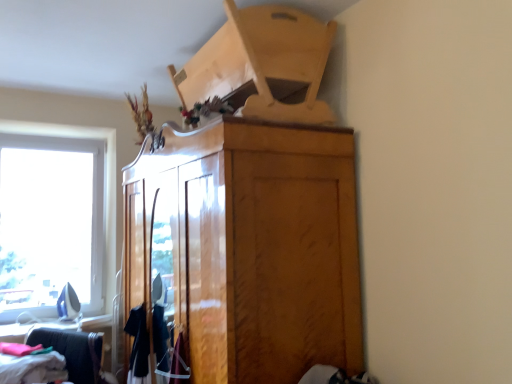
The height and width of the screenshot is (384, 512). What do you see at coordinates (73, 351) in the screenshot? I see `matte black clothing at lower left` at bounding box center [73, 351].

Measure the distance between matte black clothing at lower left and camera.

8.33 feet.

The height and width of the screenshot is (384, 512). What do you see at coordinates (138, 344) in the screenshot?
I see `black fabric shirt at lower left, positioned as the 2th clothing in right-to-left order` at bounding box center [138, 344].

The height and width of the screenshot is (384, 512). I want to click on velvet burgundy dress at lower center, arranged as the third clothing when viewed from the left, so click(x=180, y=363).

The width and height of the screenshot is (512, 384). Describe the element at coordinates (32, 368) in the screenshot. I see `soft cotton clothes at lower left, which appears as the 3th clothing when viewed from the right` at that location.

You are a GUI agent. You are given a task and a screenshot of the screen. Output one action in this format:
    pyautogui.click(x=<x>, y=<y>)
    Task: Click on the matte black clothing at lower left
    
    Given the screenshot: What is the action you would take?
    pyautogui.click(x=73, y=351)

From a real-world perspective, does black fabric shirt at lower left, positioned as the 2th clothing in right-to-left order, stand above glossy wood cabinet at center?

No, from a real-world perspective, black fabric shirt at lower left, positioned as the 2th clothing in right-to-left order, is not on top of glossy wood cabinet at center.

How many degrees apart are the facing directions of black fabric shirt at lower left, the second clothing in the left-to-right sequence, and glossy wood cabinet at center?

There is a 1.53-degree angle between the facing directions of black fabric shirt at lower left, the second clothing in the left-to-right sequence, and glossy wood cabinet at center.

Which of these two, black fabric shirt at lower left, the second clothing in the left-to-right sequence, or glossy wood cabinet at center, is smaller?

black fabric shirt at lower left, the second clothing in the left-to-right sequence, is smaller.

What's the angular difference between matte black clothing at lower left and black fabric shirt at lower left, the second clothing in the left-to-right sequence,'s facing directions?

There is a 37.9-degree angle between the facing directions of matte black clothing at lower left and black fabric shirt at lower left, the second clothing in the left-to-right sequence.

Are matte black clothing at lower left and black fabric shirt at lower left, the second clothing in the left-to-right sequence, far apart?

Actually, matte black clothing at lower left and black fabric shirt at lower left, the second clothing in the left-to-right sequence, are a little close together.

Between matte black clothing at lower left and black fabric shirt at lower left, the second clothing in the left-to-right sequence, which one is positioned behind?

black fabric shirt at lower left, the second clothing in the left-to-right sequence.

In the scene shown: Is matte black clothing at lower left oriented towards black fabric shirt at lower left, the second clothing in the left-to-right sequence?

No.

How many degrees apart are the facing directions of soft cotton clothes at lower left, which appears as the 3th clothing when viewed from the right, and velvet burgundy dress at lower center, acting as the first clothing starting from the right?

soft cotton clothes at lower left, which appears as the 3th clothing when viewed from the right, and velvet burgundy dress at lower center, acting as the first clothing starting from the right, are facing 46.9 degrees away from each other.

Is velvet burgundy dress at lower center, arranged as the third clothing when viewed from the left, at the back of soft cotton clothes at lower left, which appears as the 3th clothing when viewed from the right?

No, velvet burgundy dress at lower center, arranged as the third clothing when viewed from the left, is not at the back of soft cotton clothes at lower left, which appears as the 3th clothing when viewed from the right.

Is soft cotton clothes at lower left, which is counted as the 1th clothing, starting from the left, wider or thinner than velvet burgundy dress at lower center, arranged as the third clothing when viewed from the left?

soft cotton clothes at lower left, which is counted as the 1th clothing, starting from the left, is wider than velvet burgundy dress at lower center, arranged as the third clothing when viewed from the left.

Based on the photo, what's the angular difference between matte black clothing at lower left and soft cotton clothes at lower left, which appears as the 3th clothing when viewed from the right,'s facing directions?

matte black clothing at lower left and soft cotton clothes at lower left, which appears as the 3th clothing when viewed from the right, are facing 8.97 degrees away from each other.

Relative to soft cotton clothes at lower left, which is counted as the 1th clothing, starting from the left, is matte black clothing at lower left in front or behind?

matte black clothing at lower left is in front of soft cotton clothes at lower left, which is counted as the 1th clothing, starting from the left.

Based on the photo, is matte black clothing at lower left in contact with soft cotton clothes at lower left, which is counted as the 1th clothing, starting from the left?

No, matte black clothing at lower left is not beside soft cotton clothes at lower left, which is counted as the 1th clothing, starting from the left.

From the image's perspective, is matte black clothing at lower left located above soft cotton clothes at lower left, which appears as the 3th clothing when viewed from the right?

Actually, matte black clothing at lower left appears below soft cotton clothes at lower left, which appears as the 3th clothing when viewed from the right, in the image.

Is point (180, 354) more distant than point (345, 139)?

Yes, point (180, 354) is behind point (345, 139).

Locate an element on the screen. the 1st clothing located beneath the glossy wood cabinet at center (from a real-world perspective) is located at coordinates (180, 363).

What's the angular difference between velvet burgundy dress at lower center, arranged as the third clothing when viewed from the left, and glossy wood cabinet at center's facing directions?

velvet burgundy dress at lower center, arranged as the third clothing when viewed from the left, and glossy wood cabinet at center are facing 1.53 degrees away from each other.

Which of these two, velvet burgundy dress at lower center, arranged as the third clothing when viewed from the left, or glossy wood cabinet at center, stands taller?

glossy wood cabinet at center is taller.

Can you confirm if matte black clothing at lower left is positioned to the left of glossy wood cabinet at center?

Indeed, matte black clothing at lower left is positioned on the left side of glossy wood cabinet at center.

Considering the points (79, 345) and (337, 276), which point is behind, point (79, 345) or point (337, 276)?

The point (79, 345) is farther.

Does matte black clothing at lower left have a larger size compared to glossy wood cabinet at center?

Actually, matte black clothing at lower left might be smaller than glossy wood cabinet at center.

Is matte black clothing at lower left aimed at glossy wood cabinet at center?

No, matte black clothing at lower left is not aimed at glossy wood cabinet at center.

Measure the distance between velvet burgundy dress at lower center, acting as the first clothing starting from the right, and matte black clothing at lower left.

The distance of velvet burgundy dress at lower center, acting as the first clothing starting from the right, from matte black clothing at lower left is 1.04 meters.

Can you confirm if velvet burgundy dress at lower center, acting as the first clothing starting from the right, is taller than matte black clothing at lower left?

No, velvet burgundy dress at lower center, acting as the first clothing starting from the right, is not taller than matte black clothing at lower left.

In the image, is velvet burgundy dress at lower center, acting as the first clothing starting from the right, positioned in front of or behind matte black clothing at lower left?

Clearly, velvet burgundy dress at lower center, acting as the first clothing starting from the right, is in front of matte black clothing at lower left.

Is velvet burgundy dress at lower center, acting as the first clothing starting from the right, beside matte black clothing at lower left?

No, velvet burgundy dress at lower center, acting as the first clothing starting from the right, is not in contact with matte black clothing at lower left.

Where is `cabinetry on the right of the black fabric shirt at lower left, positioned as the 2th clothing in right-to-left order`? cabinetry on the right of the black fabric shirt at lower left, positioned as the 2th clothing in right-to-left order is located at coordinates (251, 246).

From a real-world perspective, which clothing is the 2nd one above the matte black clothing at lower left? Please provide its 2D coordinates.

[(138, 344)]

From the picture: Estimate the real-world distances between objects in this image. Which object is closer to velvet burgundy dress at lower center, arranged as the third clothing when viewed from the left, matte black clothing at lower left or black fabric shirt at lower left, positioned as the 2th clothing in right-to-left order?

Based on the image, black fabric shirt at lower left, positioned as the 2th clothing in right-to-left order, appears to be nearer to velvet burgundy dress at lower center, arranged as the third clothing when viewed from the left.

In the scene shown: Based on their spatial positions, is black fabric shirt at lower left, positioned as the 2th clothing in right-to-left order, or velvet burgundy dress at lower center, acting as the first clothing starting from the right, closer to matte black clothing at lower left?

Based on the image, black fabric shirt at lower left, positioned as the 2th clothing in right-to-left order, appears to be nearer to matte black clothing at lower left.

From the image, which object appears to be farther from matte black clothing at lower left, black fabric shirt at lower left, positioned as the 2th clothing in right-to-left order, or glossy wood cabinet at center?

Among the two, glossy wood cabinet at center is located further to matte black clothing at lower left.

Looking at the image, which one is located further to velvet burgundy dress at lower center, acting as the first clothing starting from the right, black fabric shirt at lower left, the second clothing in the left-to-right sequence, or glossy wood cabinet at center?

Among the two, glossy wood cabinet at center is located further to velvet burgundy dress at lower center, acting as the first clothing starting from the right.

When comparing their distances from glossy wood cabinet at center, does matte black clothing at lower left or velvet burgundy dress at lower center, acting as the first clothing starting from the right, seem further?

The object further to glossy wood cabinet at center is matte black clothing at lower left.

Estimate the real-world distances between objects in this image. Which object is closer to velvet burgundy dress at lower center, acting as the first clothing starting from the right, glossy wood cabinet at center or matte black clothing at lower left?

Among the two, glossy wood cabinet at center is located nearer to velvet burgundy dress at lower center, acting as the first clothing starting from the right.

Considering their positions, is black fabric shirt at lower left, positioned as the 2th clothing in right-to-left order, positioned closer to glossy wood cabinet at center than soft cotton clothes at lower left, which is counted as the 1th clothing, starting from the left?

black fabric shirt at lower left, positioned as the 2th clothing in right-to-left order.

Which object lies further to the anchor point soft cotton clothes at lower left, which is counted as the 1th clothing, starting from the left, black fabric shirt at lower left, the second clothing in the left-to-right sequence, or velvet burgundy dress at lower center, acting as the first clothing starting from the right?

velvet burgundy dress at lower center, acting as the first clothing starting from the right, lies further to soft cotton clothes at lower left, which is counted as the 1th clothing, starting from the left, than the other object.

Find the location of a particular element. This screenshot has width=512, height=384. clothing located between matte black clothing at lower left and velvet burgundy dress at lower center, acting as the first clothing starting from the right, in the left-right direction is located at coordinates (138, 344).

Locate an element on the screen. The height and width of the screenshot is (384, 512). clothing between soft cotton clothes at lower left, which is counted as the 1th clothing, starting from the left, and velvet burgundy dress at lower center, acting as the first clothing starting from the right, from left to right is located at coordinates (138, 344).

Where is `furniture situated between soft cotton clothes at lower left, which appears as the 3th clothing when viewed from the right, and velvet burgundy dress at lower center, arranged as the third clothing when viewed from the left, from left to right`? The image size is (512, 384). furniture situated between soft cotton clothes at lower left, which appears as the 3th clothing when viewed from the right, and velvet burgundy dress at lower center, arranged as the third clothing when viewed from the left, from left to right is located at coordinates (73, 351).

Where is `furniture situated between soft cotton clothes at lower left, which is counted as the 1th clothing, starting from the left, and black fabric shirt at lower left, the second clothing in the left-to-right sequence, from left to right`? This screenshot has width=512, height=384. furniture situated between soft cotton clothes at lower left, which is counted as the 1th clothing, starting from the left, and black fabric shirt at lower left, the second clothing in the left-to-right sequence, from left to right is located at coordinates (73, 351).